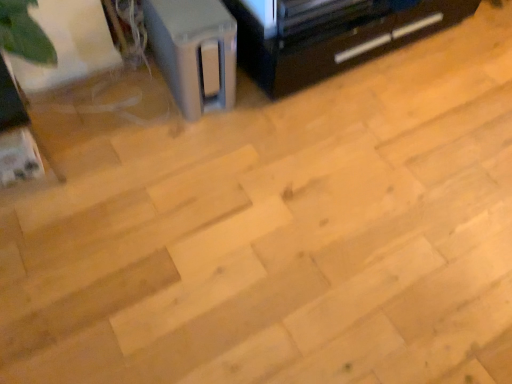
Where is `free point to the right of black plastic tv stand at upper right`? The height and width of the screenshot is (384, 512). free point to the right of black plastic tv stand at upper right is located at coordinates (458, 61).